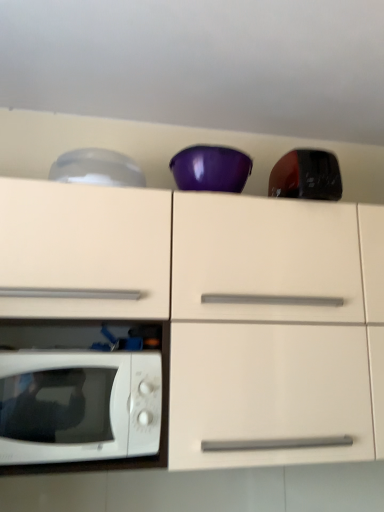
Question: From a real-world perspective, is white glossy microwave oven at lower left beneath glossy black toaster at upper right, arranged as the 2th appliance when viewed from the left?

Choices:
 (A) no
 (B) yes

Answer: (B)

Question: Is white glossy microwave oven at lower left located outside glossy black toaster at upper right, arranged as the first appliance when viewed from the right?

Choices:
 (A) no
 (B) yes

Answer: (B)

Question: From the image's perspective, is white glossy microwave oven at lower left located beneath glossy black toaster at upper right, arranged as the 2th appliance when viewed from the left?

Choices:
 (A) yes
 (B) no

Answer: (A)

Question: Does white glossy microwave oven at lower left have a larger size compared to glossy black toaster at upper right, arranged as the 2th appliance when viewed from the left?

Choices:
 (A) no
 (B) yes

Answer: (B)

Question: Could you tell me if white glossy microwave oven at lower left is facing glossy black toaster at upper right, arranged as the 2th appliance when viewed from the left?

Choices:
 (A) yes
 (B) no

Answer: (B)

Question: Does white glossy microwave oven at lower left have a smaller size compared to glossy black toaster at upper right, arranged as the 2th appliance when viewed from the left?

Choices:
 (A) no
 (B) yes

Answer: (A)

Question: Does glossy black toaster at upper right, arranged as the 2th appliance when viewed from the left, have a greater width compared to white glossy microwave oven at lower left?

Choices:
 (A) no
 (B) yes

Answer: (A)

Question: Are glossy black toaster at upper right, arranged as the 2th appliance when viewed from the left, and white glossy microwave oven at lower left located far from each other?

Choices:
 (A) no
 (B) yes

Answer: (A)

Question: Is glossy black toaster at upper right, arranged as the first appliance when viewed from the right, aimed at white glossy microwave oven at lower left?

Choices:
 (A) yes
 (B) no

Answer: (B)

Question: Is glossy black toaster at upper right, arranged as the first appliance when viewed from the right, facing away from white glossy microwave oven at lower left?

Choices:
 (A) no
 (B) yes

Answer: (A)

Question: Is glossy black toaster at upper right, arranged as the first appliance when viewed from the right, taller than white glossy microwave oven at lower left?

Choices:
 (A) no
 (B) yes

Answer: (A)

Question: Does glossy black toaster at upper right, arranged as the first appliance when viewed from the right, have a larger size compared to white glossy microwave oven at lower left?

Choices:
 (A) yes
 (B) no

Answer: (B)

Question: Is white glossy microwave oven at lower left oriented towards white glossy cabinet at center?

Choices:
 (A) yes
 (B) no

Answer: (A)